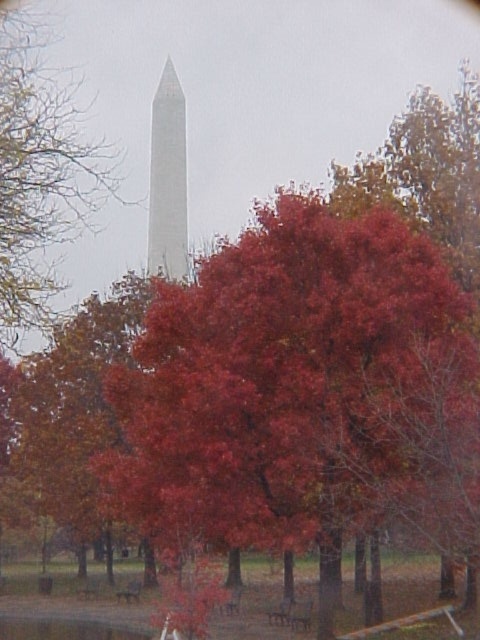
You are a photographer planning to capture a photo that includes both the shiny red leaves at center and the smooth red tree at upper center. Given that your camera has a maximum focus range of 9 meters, will you be able to capture both objects in focus without adjusting your position?

The shiny red leaves at center and smooth red tree at upper center are 9.30 meters apart from each other. Since the distance between them exceeds the camera maximum focus range of 9 meters, you won

From the picture: You are standing at the point marked as point (350, 416) in the image. The monument in the background is 22.82 meters away from you. If you want to take a photo of the monument with the red maple tree in the foreground, will you need to zoom in or out to include both the monument and the red maple tree in the frame?

Since the monument is 22.82 meters away from the point marked as point (350, 416), you would need to zoom out to include both the monument and the red maple tree in the frame.

You are planning to take a photo of the smooth red tree at upper center and the tall white monument in the background. Given their positions, which object is closer to the camera?

The smooth red tree at upper center is closer to the camera because it is positioned at point (39, 177), which is closer than the monument in the background.